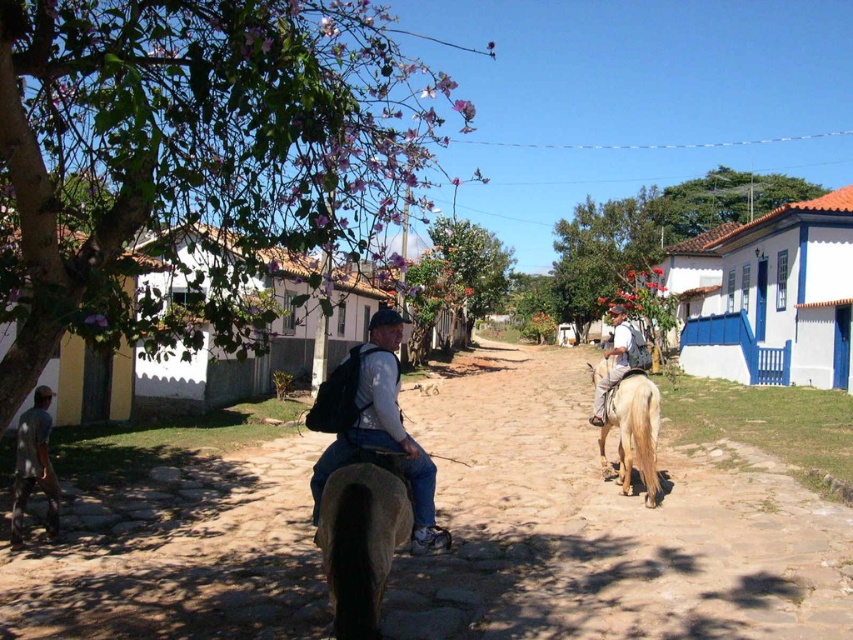
Question: Is matte black backpack at center below gray fabric shirt at lower left?

Choices:
 (A) yes
 (B) no

Answer: (B)

Question: Can you confirm if matte black backpack at center is smaller than light brown leather jacket at center?

Choices:
 (A) yes
 (B) no

Answer: (A)

Question: Which of the following is the farthest from the observer?

Choices:
 (A) matte black backpack at center
 (B) light brown leather jacket at center

Answer: (B)

Question: Does golden blonde horse at right have a lesser width compared to gray fabric shirt at lower left?

Choices:
 (A) no
 (B) yes

Answer: (B)

Question: Which point is farther from the camera taking this photo?

Choices:
 (A) (329, 593)
 (B) (143, 544)

Answer: (B)

Question: Among these objects, which one is nearest to the camera?

Choices:
 (A) brown dirt track at center
 (B) brown matte horse at center
 (C) matte black backpack at center
 (D) gray fabric shirt at lower left

Answer: (B)